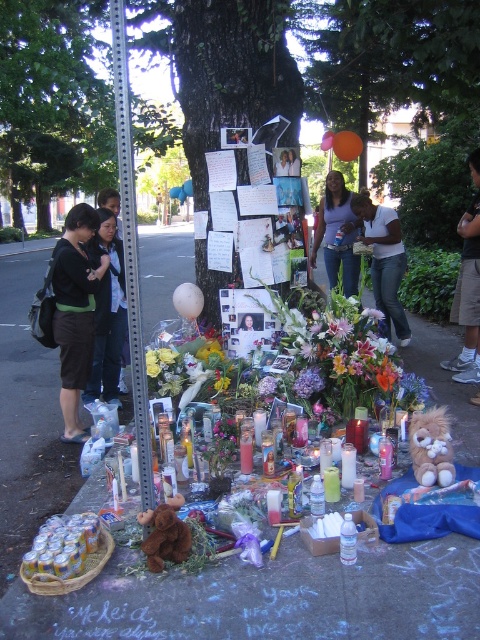
Question: Estimate the real-world distances between objects in this image. Which object is farther from the purple fabric flower at center?

Choices:
 (A) smooth concrete sidewalk at center
 (B) matte purple shirt at center
 (C) black fabric shirt at left
 (D) purple matte flower at center

Answer: (B)

Question: Considering the real-world distances, which object is farthest from the purple matte flower at center?

Choices:
 (A) white cotton shirt at center
 (B) smooth skin face at center

Answer: (A)

Question: Which point is farther from the camera taking this photo?

Choices:
 (A) (364, 232)
 (B) (269, 388)
 (C) (291, 163)

Answer: (A)

Question: Is smooth concrete sidewalk at center further to camera compared to matte black shirt at left?

Choices:
 (A) yes
 (B) no

Answer: (B)

Question: Is white cotton shirt at center to the right of smooth skin face at center from the viewer's perspective?

Choices:
 (A) no
 (B) yes

Answer: (B)

Question: Does matte purple shirt at center appear on the left side of purple matte flower at center?

Choices:
 (A) yes
 (B) no

Answer: (B)